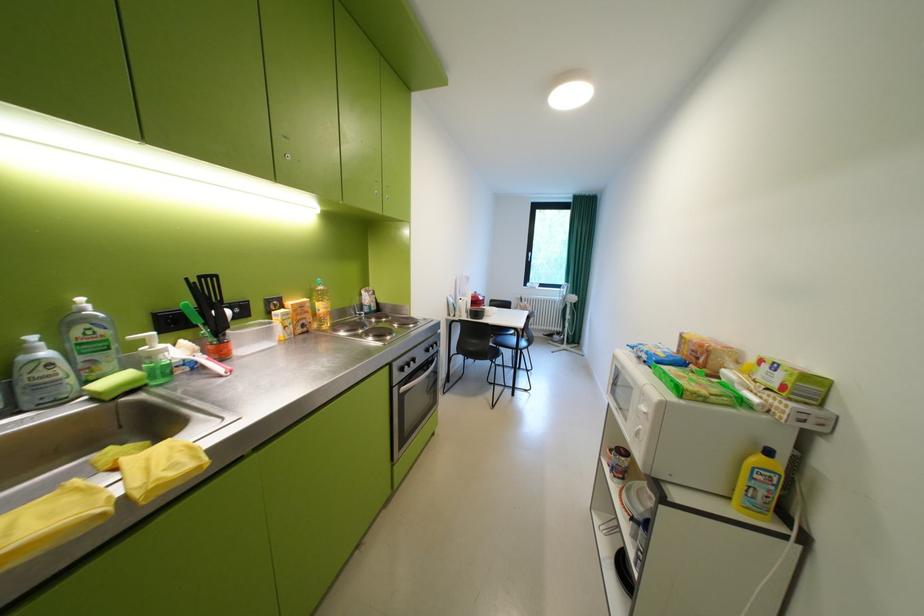
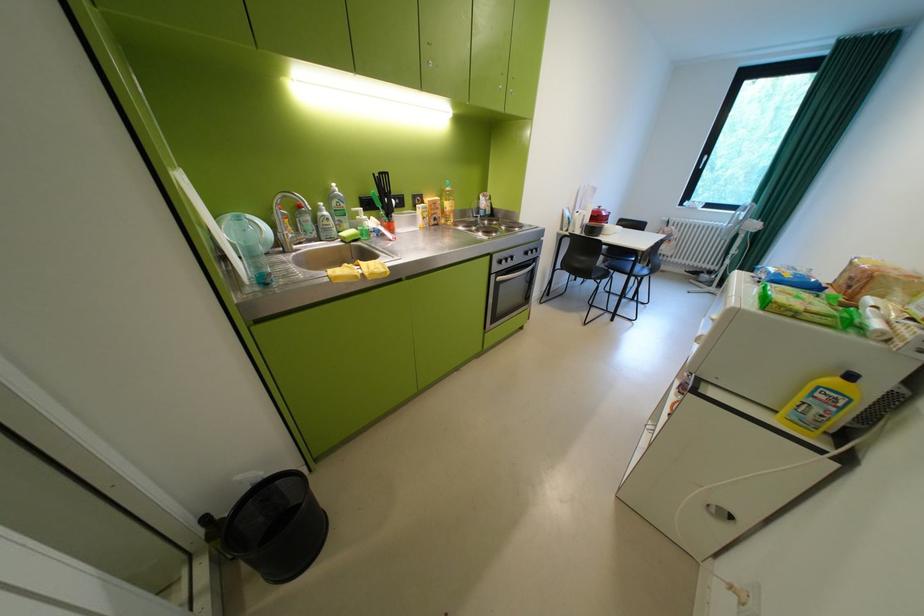
Locate, in the second image, the point that corresponds to the point at 418,424 in the first image.

(511, 310)